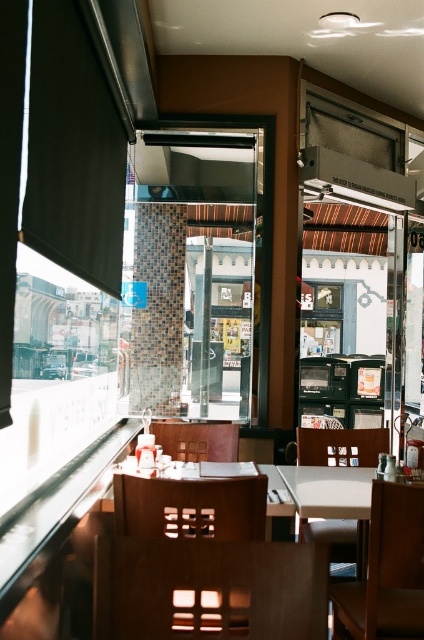
Question: Among these objects, which one is nearest to the camera?

Choices:
 (A) brown leather chair at lower right
 (B) brown leather chair at center

Answer: (A)

Question: Estimate the real-world distances between objects in this image. Which object is closer to the wooden table at center?

Choices:
 (A) wooden chair at lower center
 (B) wooden chair at center
 (C) white plastic chair at center
 (D) brown leather chair at lower right

Answer: (B)

Question: Is wooden chair at center further to the viewer compared to brown leather chair at lower right?

Choices:
 (A) no
 (B) yes

Answer: (A)

Question: Which of the following is the farthest from the observer?

Choices:
 (A) (192, 515)
 (B) (268, 552)
 (C) (211, 426)

Answer: (C)

Question: Does wooden chair at lower center lie in front of brown leather chair at lower right?

Choices:
 (A) yes
 (B) no

Answer: (A)

Question: Does wooden chair at lower center lie behind brown leather chair at lower right?

Choices:
 (A) no
 (B) yes

Answer: (A)